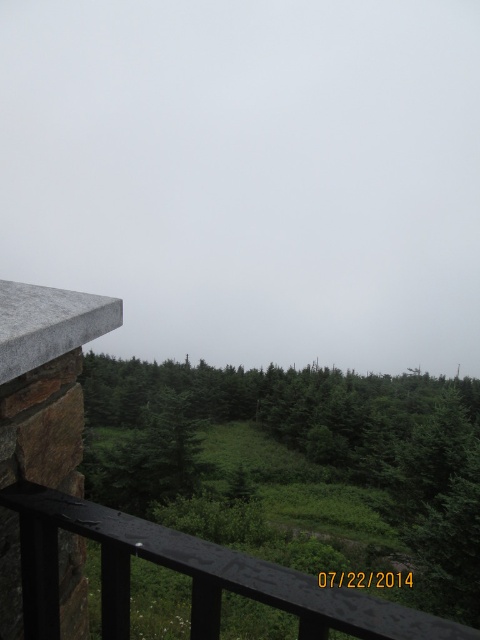
Question: Which point is farther to the camera?

Choices:
 (A) (279, 589)
 (B) (470, 435)

Answer: (B)

Question: Is green matte tree at center wider than black wood rail at lower left?

Choices:
 (A) yes
 (B) no

Answer: (A)

Question: Which object is closer to the camera taking this photo?

Choices:
 (A) black wood rail at lower left
 (B) green matte tree at center

Answer: (A)

Question: Does green matte tree at center have a lesser width compared to black wood rail at lower left?

Choices:
 (A) no
 (B) yes

Answer: (A)

Question: Does green matte tree at center appear under black wood rail at lower left?

Choices:
 (A) no
 (B) yes

Answer: (B)